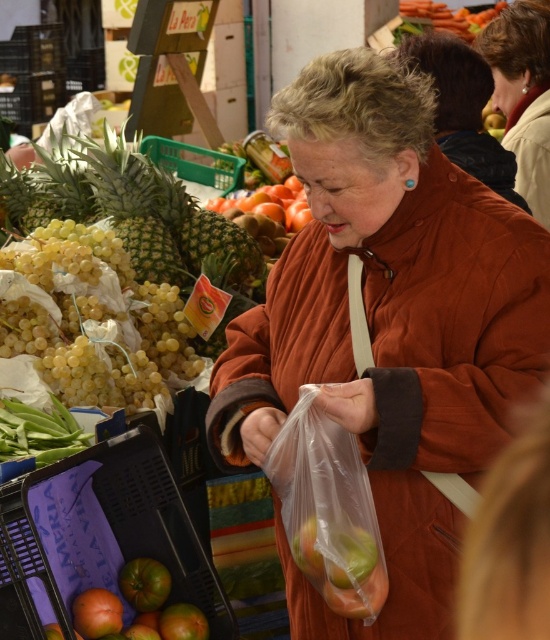
Question: Which point appears closest to the camera in this image?

Choices:
 (A) (547, 76)
 (B) (389, 573)
 (C) (201, 637)

Answer: (B)

Question: In this image, where is brown suede coat at center located relative to green textured pineapple at upper left?

Choices:
 (A) right
 (B) left

Answer: (A)

Question: Can you confirm if brown suede coat at center is bigger than green leafy vegetable at lower left?

Choices:
 (A) yes
 (B) no

Answer: (A)

Question: Which of the following is the closest to the observer?

Choices:
 (A) (444, 22)
 (B) (437, 92)
 (C) (45, 632)
 (D) (520, 54)

Answer: (C)

Question: Which of the following is the farthest from the observer?

Choices:
 (A) ripe tomato at lower left
 (B) brown suede coat at center

Answer: (A)

Question: Can you confirm if brown suede coat at center is thinner than green textured pineapple at upper left?

Choices:
 (A) yes
 (B) no

Answer: (B)